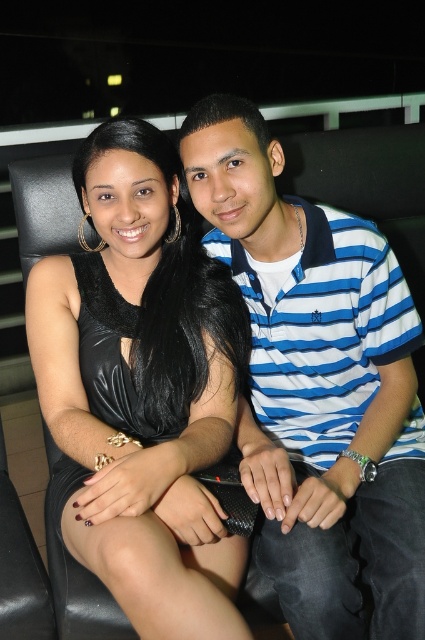
Does blue striped polo shirt at center have a lesser width compared to black leather dress at center?

No.

Which is behind, point (390, 486) or point (113, 346)?

Point (113, 346)

Is point (314, 317) farther from camera compared to point (65, 490)?

That is True.

You are a GUI agent. You are given a task and a screenshot of the screen. Output one action in this format:
    pyautogui.click(x=<x>, y=<y>)
    Task: Click on the blue striped polo shirt at center
    The width and height of the screenshot is (425, 640).
    Given the screenshot: What is the action you would take?
    (317, 385)